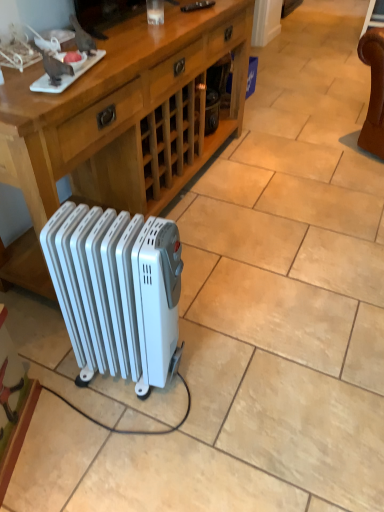
The image size is (384, 512). Describe the element at coordinates (120, 124) in the screenshot. I see `wooden desk at center` at that location.

From the picture: What is the approximate width of wooden desk at center?

19.20 inches.

This screenshot has height=512, width=384. What are the coordinates of `wooden desk at center` in the screenshot? It's located at (120, 124).

Where is `white plastic radiator at lower center`? white plastic radiator at lower center is located at coordinates (116, 289).

The height and width of the screenshot is (512, 384). Describe the element at coordinates (116, 289) in the screenshot. I see `white plastic radiator at lower center` at that location.

Find the location of a particular element. wooden desk at center is located at coordinates (120, 124).

Is white plastic radiator at lower center to the left of wooden desk at center from the viewer's perspective?

Incorrect, white plastic radiator at lower center is not on the left side of wooden desk at center.

Who is more distant, white plastic radiator at lower center or wooden desk at center?

wooden desk at center is further away from the camera.

Does point (124, 325) appear closer or farther from the camera than point (164, 114)?

Clearly, point (124, 325) is closer to the camera than point (164, 114).

From the image's perspective, which is below, white plastic radiator at lower center or wooden desk at center?

white plastic radiator at lower center appears lower in the image.

From a real-world perspective, is white plastic radiator at lower center located beneath wooden desk at center?

Yes, from a real-world perspective, white plastic radiator at lower center is beneath wooden desk at center.

Considering the relative sizes of white plastic radiator at lower center and wooden desk at center in the image provided, is white plastic radiator at lower center thinner than wooden desk at center?

Correct, the width of white plastic radiator at lower center is less than that of wooden desk at center.

Considering the relative sizes of white plastic radiator at lower center and wooden desk at center in the image provided, is white plastic radiator at lower center shorter than wooden desk at center?

Correct, white plastic radiator at lower center is not as tall as wooden desk at center.

Based on their sizes in the image, would you say white plastic radiator at lower center is bigger or smaller than wooden desk at center?

white plastic radiator at lower center is smaller than wooden desk at center.

Is white plastic radiator at lower center not inside wooden desk at center?

Indeed, white plastic radiator at lower center is completely outside wooden desk at center.

Does white plastic radiator at lower center touch wooden desk at center?

white plastic radiator at lower center is not next to wooden desk at center, and they're not touching.

Is white plastic radiator at lower center turned away from wooden desk at center?

No, white plastic radiator at lower center's orientation is not away from wooden desk at center.

How many degrees apart are the facing directions of white plastic radiator at lower center and wooden desk at center?

There is a 13.7-degree angle between the facing directions of white plastic radiator at lower center and wooden desk at center.

The image size is (384, 512). Identify the location of radiator that appears below the wooden desk at center (from the image's perspective). (116, 289).

Considering the relative positions of wooden desk at center and white plastic radiator at lower center in the image provided, is wooden desk at center to the left of white plastic radiator at lower center from the viewer's perspective?

Yes, wooden desk at center is to the left of white plastic radiator at lower center.

Does wooden desk at center lie in front of white plastic radiator at lower center?

No.

Does point (22, 108) lie behind point (170, 230)?

Yes, it is behind point (170, 230).

From the image's perspective, is wooden desk at center above white plastic radiator at lower center?

Yes, from the image's perspective, wooden desk at center is over white plastic radiator at lower center.

From a real-world perspective, is wooden desk at center positioned over white plastic radiator at lower center based on gravity?

Yes, from a real-world perspective, wooden desk at center is over white plastic radiator at lower center

Looking at their sizes, would you say wooden desk at center is wider or thinner than white plastic radiator at lower center?

Clearly, wooden desk at center has more width compared to white plastic radiator at lower center.

In terms of height, does wooden desk at center look taller or shorter compared to white plastic radiator at lower center?

Clearly, wooden desk at center is taller compared to white plastic radiator at lower center.

Can you confirm if wooden desk at center is smaller than white plastic radiator at lower center?

No.

Would you say wooden desk at center contains white plastic radiator at lower center?

No, white plastic radiator at lower center is not inside wooden desk at center.

Would you say wooden desk at center is a long distance from white plastic radiator at lower center?

Actually, wooden desk at center and white plastic radiator at lower center are a little close together.

Is wooden desk at center oriented towards white plastic radiator at lower center?

Yes.

How different are the orientations of wooden desk at center and white plastic radiator at lower center in degrees?

The angular difference between wooden desk at center and white plastic radiator at lower center is 13.7 degrees.

Locate an element on the screen. radiator below the wooden desk at center (from a real-world perspective) is located at coordinates (116, 289).

Image resolution: width=384 pixels, height=512 pixels. In order to click on radiator below the wooden desk at center (from the image's perspective) in this screenshot , I will do `click(116, 289)`.

Find the location of a particular element. This screenshot has width=384, height=512. radiator that is on the right side of wooden desk at center is located at coordinates (116, 289).